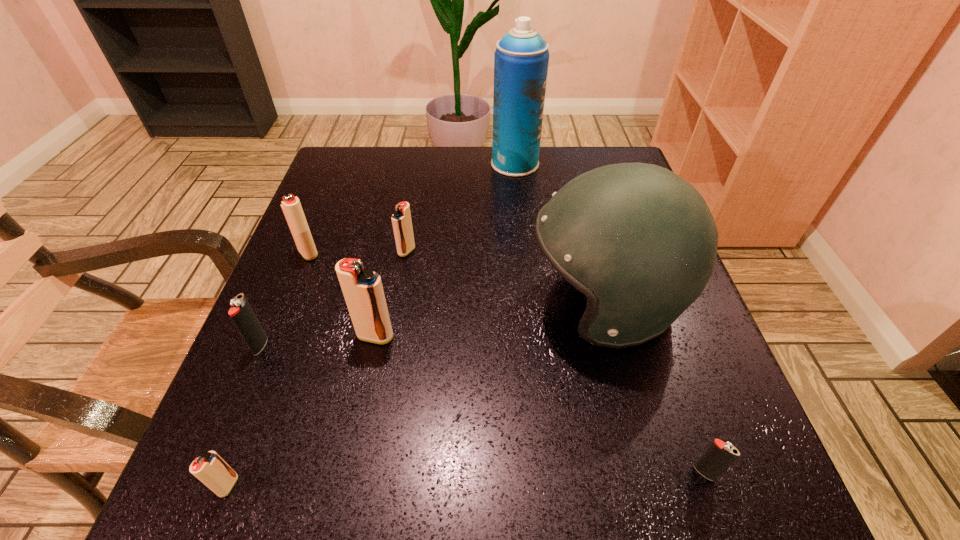
The width and height of the screenshot is (960, 540). Identify the location of aerosol can. (521, 59).

Find the location of a particular element. the farthest object is located at coordinates (521, 59).

Where is `green football helmet`? The height and width of the screenshot is (540, 960). green football helmet is located at coordinates (640, 242).

Find the location of a particular element. The image size is (960, 540). the second tallest object is located at coordinates (640, 242).

I want to click on the tallest igniter, so (x=362, y=288).

This screenshot has width=960, height=540. What are the coordinates of `the second nearest red igniter` in the screenshot? It's located at (362, 288).

At what (x,y) coordinates should I click in order to perform the action: click on the second tallest igniter. Please return your answer as a coordinate pair (x, y). This screenshot has height=540, width=960. Looking at the image, I should click on (291, 206).

The width and height of the screenshot is (960, 540). Identify the location of the fifth shortest object. (291, 206).

The width and height of the screenshot is (960, 540). Find the location of `the farther black igniter`. the farther black igniter is located at coordinates (241, 313).

You are a GUI agent. You are given a task and a screenshot of the screen. Output one action in this format:
    pyautogui.click(x=<x>, y=<y>)
    Task: Click on the bigger black igniter
    
    Given the screenshot: What is the action you would take?
    [241, 313]